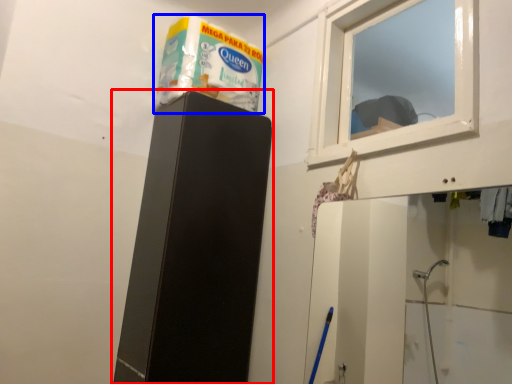
Question: Which object appears closest to the camera in this image, furniture (highlighted by a red box) or product (highlighted by a blue box)?

Choices:
 (A) furniture
 (B) product

Answer: (A)